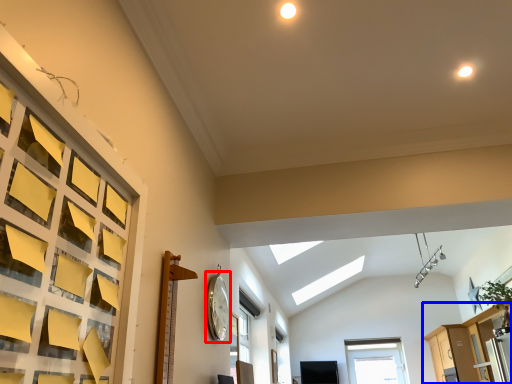
Question: Which object is closer to the camera taking this photo, clock (highlighted by a red box) or dresser (highlighted by a blue box)?

Choices:
 (A) clock
 (B) dresser

Answer: (A)